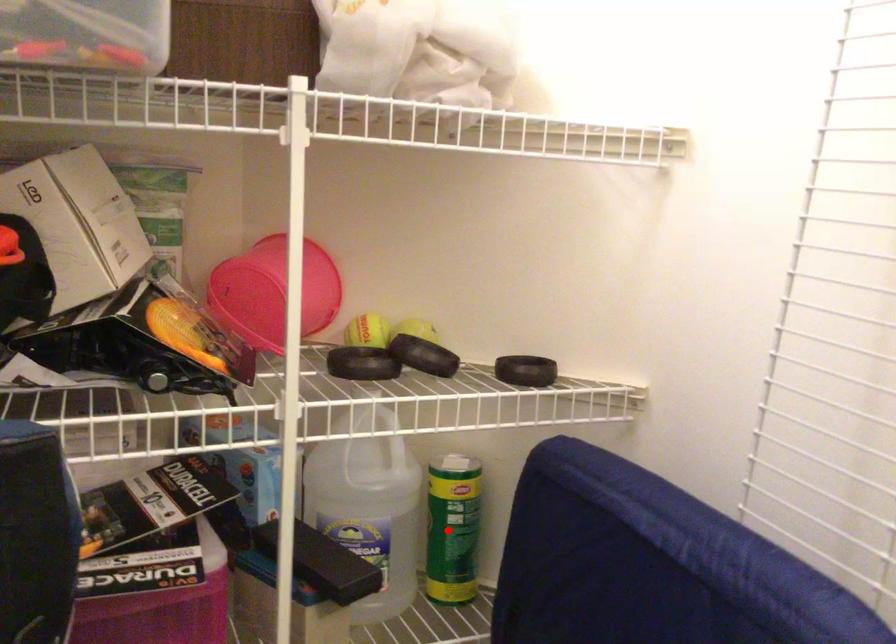
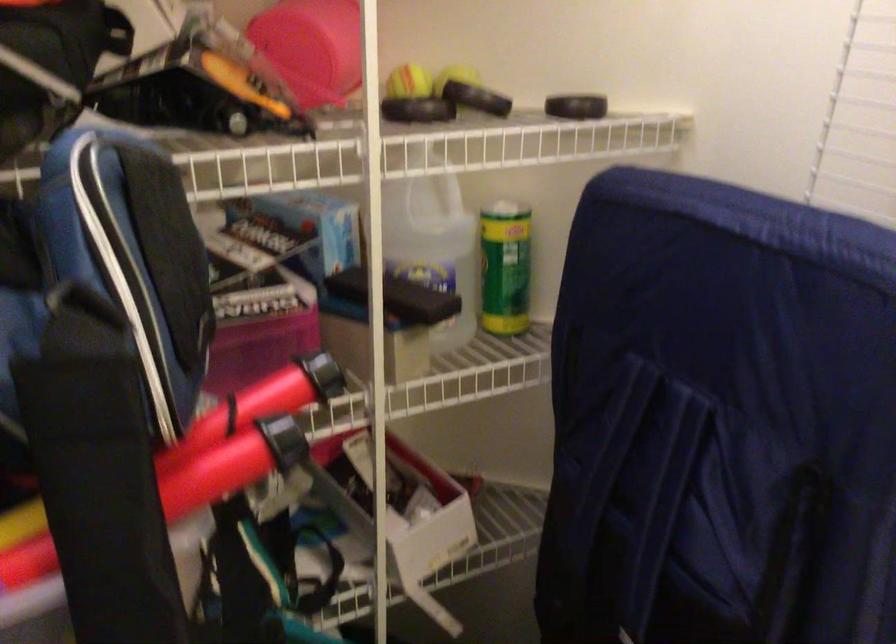
In the second image, find the point that corresponds to the highlighted location in the first image.

(504, 267)